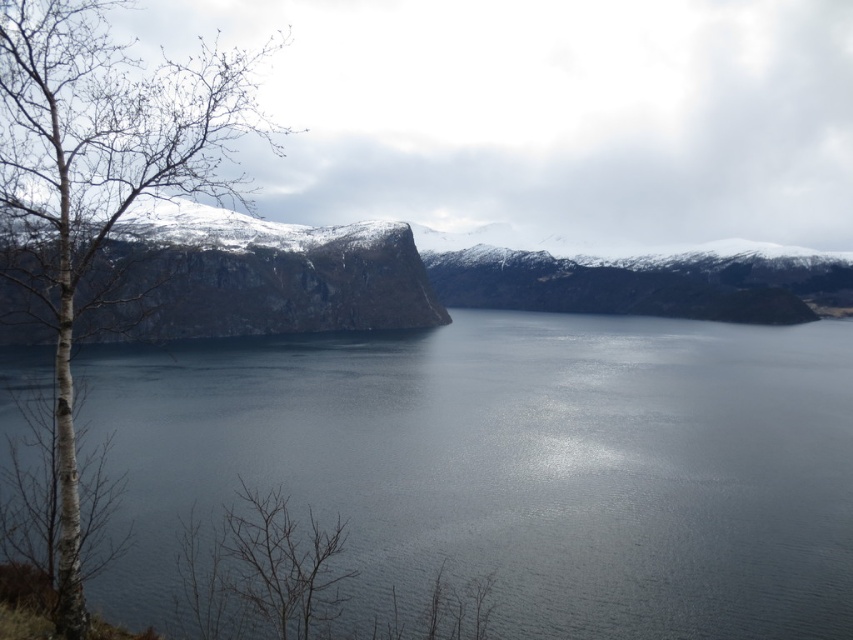
Who is more forward, (27, 285) or (169, 292)?

Point (27, 285) is more forward.

Is bare bark tree at left shorter than snowy rock cliff at left?

No, bare bark tree at left is not shorter than snowy rock cliff at left.

Describe the element at coordinates (97, 179) in the screenshot. I see `bare bark tree at left` at that location.

Identify the location of bare bark tree at left. The image size is (853, 640). (97, 179).

Does dark gray water at center come behind snowy rock cliff at left?

Yes.

The width and height of the screenshot is (853, 640). In order to click on dark gray water at center in this screenshot , I will do `click(515, 467)`.

What do you see at coordinates (515, 467) in the screenshot? I see `dark gray water at center` at bounding box center [515, 467].

Where is `dark gray water at center`? Image resolution: width=853 pixels, height=640 pixels. dark gray water at center is located at coordinates (515, 467).

Does dark gray water at center have a greater width compared to bare bark tree at left?

Yes, dark gray water at center is wider than bare bark tree at left.

Is point (419, 564) closer to viewer compared to point (94, 10)?

Yes, it is in front of point (94, 10).

The image size is (853, 640). In order to click on dark gray water at center in this screenshot , I will do `click(515, 467)`.

This screenshot has width=853, height=640. Identify the location of dark gray water at center. (515, 467).